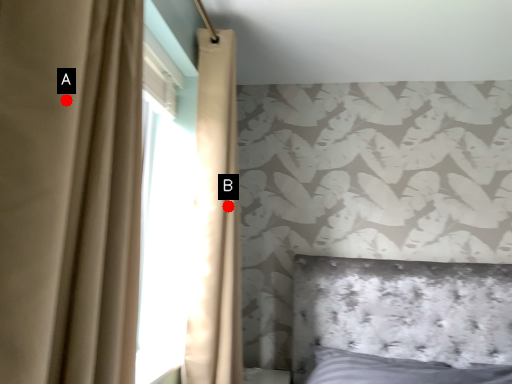
Question: Two points are circled on the image, labeled by A and B beside each circle. Which of the following is the farthest from the observer?

Choices:
 (A) A is further
 (B) B is further

Answer: (B)